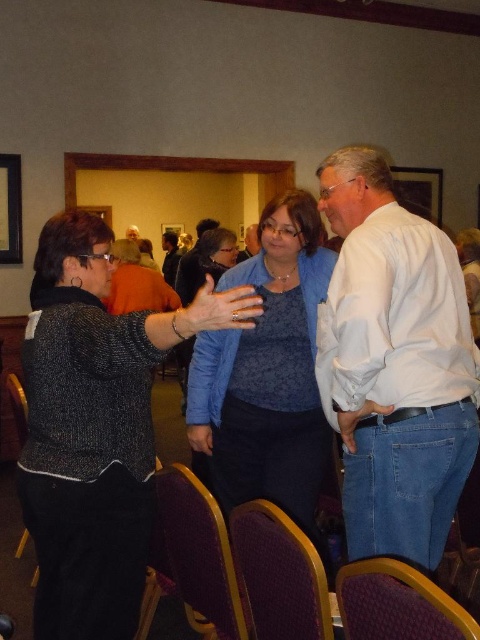
Based on the photo, you are an interior designer assessing the layout of this room. The blue textured sweater at center and the purple fabric chair at lower center are both in the foreground. Which object is taller?

The blue textured sweater at center is taller than the purple fabric chair at lower center.

You are organizing a photo shoot and need to ensure that the black textured sweater at left and the velvet purple chair at center are both visible in the frame. Given their sizes, which object might require more space in the composition?

The black textured sweater at left is larger in size than the velvet purple chair at center, so it would require more space in the composition.